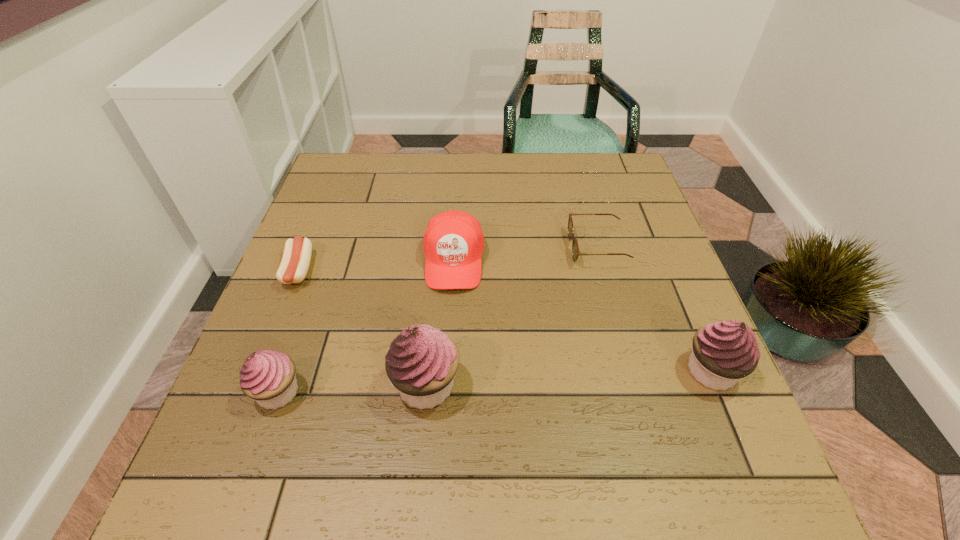
The image size is (960, 540). In order to click on spot to insert another cupcake for uniform distribution in this screenshot , I will do `click(570, 377)`.